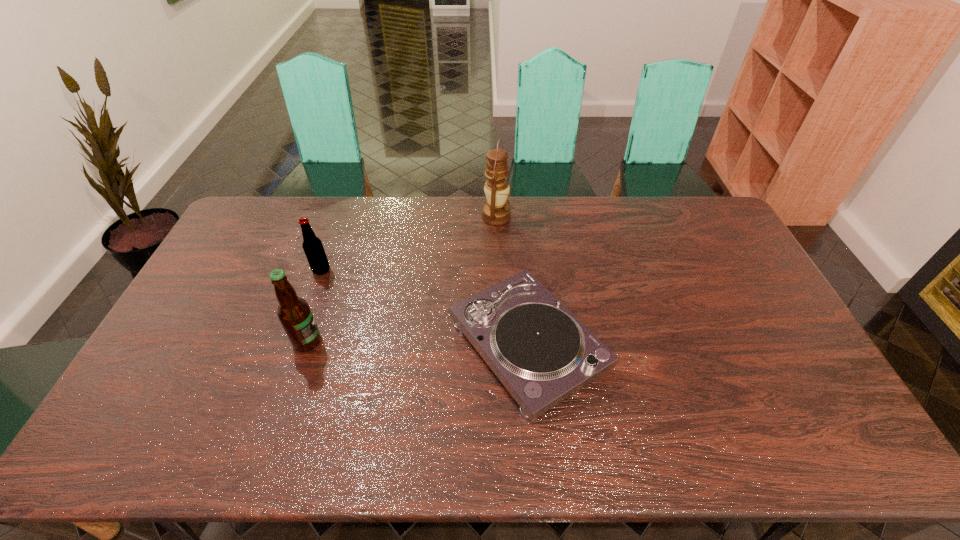
Find the location of a particular element. free space between the oil lamp and the nearer beer bottle is located at coordinates (402, 279).

Image resolution: width=960 pixels, height=540 pixels. I want to click on vacant area that lies between the shortest object and the third tallest object, so (x=424, y=307).

What are the coordinates of `unoccupied area between the farther beer bottle and the oil lamp` in the screenshot? It's located at (409, 244).

In order to click on free space between the second farthest object and the nearer beer bottle in this screenshot , I will do `click(315, 306)`.

This screenshot has height=540, width=960. I want to click on object that stands as the closest to the taller beer bottle, so click(312, 245).

Find the location of `object that is the closest to the shortest object`. object that is the closest to the shortest object is located at coordinates (496, 212).

Image resolution: width=960 pixels, height=540 pixels. In order to click on free space that satisfies the following two spatial constraints: 1. on the front side of the farther beer bottle; 2. on the right side of the record player in this screenshot , I will do `click(295, 345)`.

This screenshot has height=540, width=960. In order to click on free space that satisfies the following two spatial constraints: 1. on the front side of the record player; 2. on the left side of the oil lamp in this screenshot , I will do `click(501, 345)`.